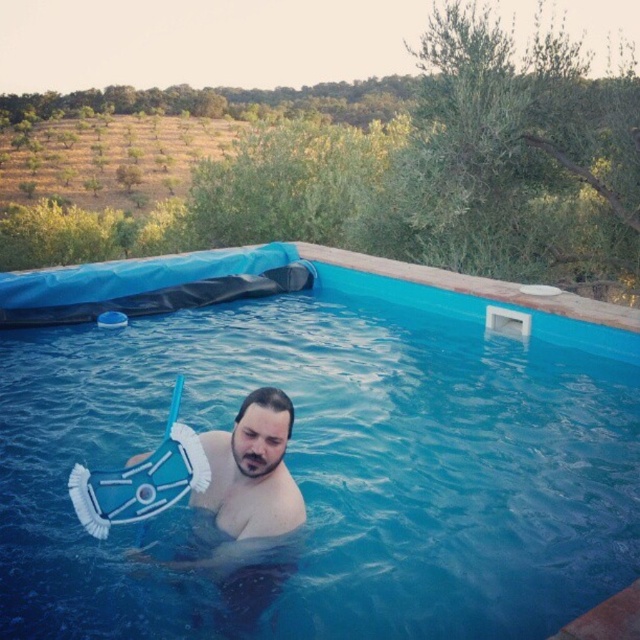
Who is lower down, blue plastic pool at center or blue plastic snorkel at center?

Positioned lower is blue plastic pool at center.

Can you confirm if blue plastic pool at center is taller than blue plastic snorkel at center?

In fact, blue plastic pool at center may be shorter than blue plastic snorkel at center.

Is point (384, 401) farther from viewer compared to point (266, 440)?

Yes, point (384, 401) is behind point (266, 440).

The height and width of the screenshot is (640, 640). In order to click on blue plastic pool at center in this screenshot , I will do `click(332, 449)`.